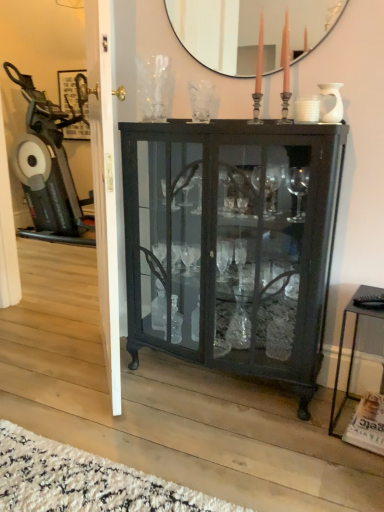
The image size is (384, 512). Identify the location of vacant area that lies to the right of white shag rug at lower left. (253, 451).